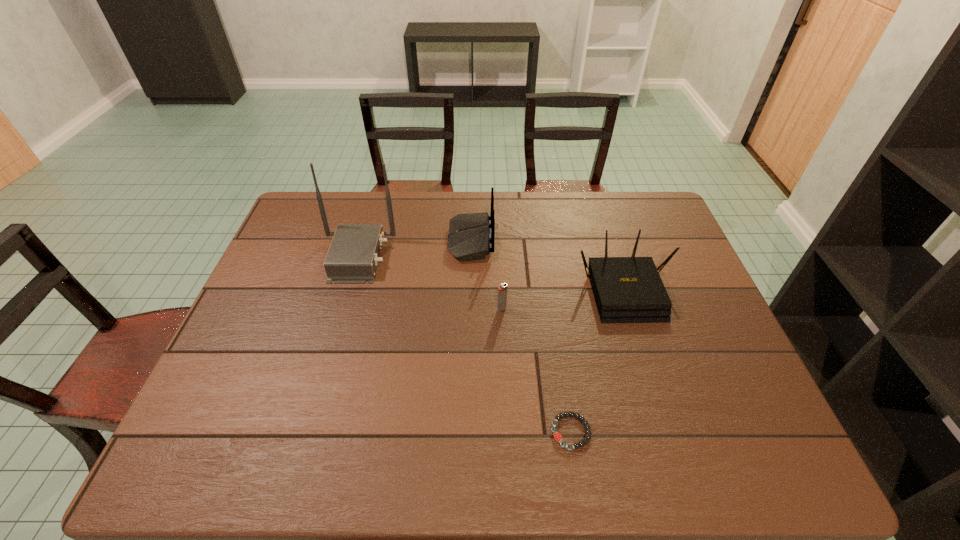
I want to click on empty space that is in between the rightmost object and the fourth object from left to right, so click(598, 361).

The height and width of the screenshot is (540, 960). Identify the location of blank region between the shortest object and the second router from left to right. (520, 336).

This screenshot has width=960, height=540. Identify the location of free space between the fourth tallest object and the shortest object. (536, 370).

Locate an element on the screen. free space that is in between the third object from right to left and the second router from right to left is located at coordinates (486, 274).

Select which object is the third closest to the third object from left to right. Please provide its 2D coordinates. Your answer should be formatted as a tuple, i.e. [(x, y)], where the tuple contains the x and y coordinates of a point satisfying the conditions above.

[(557, 436)]

Where is `object that stands as the third closest to the leftmost object`? This screenshot has height=540, width=960. object that stands as the third closest to the leftmost object is located at coordinates (626, 289).

Locate which router is the closest to the third object from right to left. Please provide its 2D coordinates. Your answer should be formatted as a tuple, i.e. [(x, y)], where the tuple contains the x and y coordinates of a point satisfying the conditions above.

[(469, 239)]

You are a GUI agent. You are given a task and a screenshot of the screen. Output one action in this format:
    pyautogui.click(x=<x>, y=<y>)
    Task: Click on the router identified as the third closest to the second object from right to left
    The height and width of the screenshot is (540, 960).
    Given the screenshot: What is the action you would take?
    pyautogui.click(x=353, y=256)

Where is `vacant space that satisfies the following two spatial constraints: 1. on the back of the tallest router to connect cables; 2. on the left side of the bracelet`? The image size is (960, 540). vacant space that satisfies the following two spatial constraints: 1. on the back of the tallest router to connect cables; 2. on the left side of the bracelet is located at coordinates (306, 432).

Identify the location of vacant area that satisfies the following two spatial constraints: 1. on the back of the tallest router to connect cables; 2. on the right side of the nearest object. Image resolution: width=960 pixels, height=540 pixels. (306, 432).